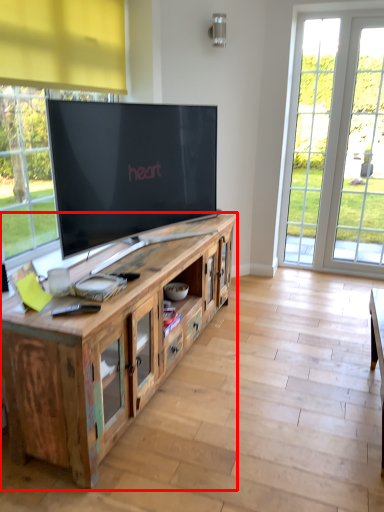
Question: From the image's perspective, considering the relative positions of cabinetry (annotated by the red box) and window in the image provided, where is cabinetry (annotated by the red box) located with respect to the staircase?

Choices:
 (A) below
 (B) above

Answer: (A)